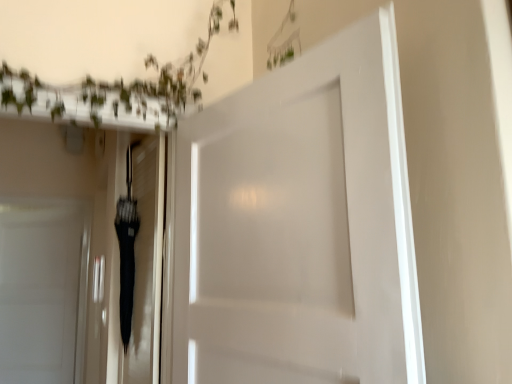
Question: Can you see black glossy umbrella at center touching white matte door at center, the second door from the back?

Choices:
 (A) yes
 (B) no

Answer: (B)

Question: Can you confirm if black glossy umbrella at center is positioned to the left of white matte door at center, acting as the 1th door starting from the front?

Choices:
 (A) yes
 (B) no

Answer: (A)

Question: Is black glossy umbrella at center not inside white matte door at center, placed as the first door when sorted from right to left?

Choices:
 (A) no
 (B) yes

Answer: (B)

Question: Is black glossy umbrella at center at the right side of white matte door at center, placed as the first door when sorted from right to left?

Choices:
 (A) yes
 (B) no

Answer: (B)

Question: From a real-world perspective, is black glossy umbrella at center located beneath white matte door at center, positioned as the second door in left-to-right order?

Choices:
 (A) yes
 (B) no

Answer: (A)

Question: From a real-world perspective, relative to white matte door at center, the second door from the back, is black glossy umbrella at center vertically above or below?

Choices:
 (A) below
 (B) above

Answer: (A)

Question: In the image, is black glossy umbrella at center positioned in front of or behind white matte door at center, the second door from the back?

Choices:
 (A) behind
 (B) front

Answer: (A)

Question: Which is correct: black glossy umbrella at center is inside white matte door at center, acting as the 1th door starting from the front, or outside of it?

Choices:
 (A) inside
 (B) outside

Answer: (B)

Question: Looking at the image, does black glossy umbrella at center seem bigger or smaller compared to white matte door at center, positioned as the second door in left-to-right order?

Choices:
 (A) big
 (B) small

Answer: (B)

Question: Is white matte door at left, the second door when ordered from front to back, wider or thinner than white matte door at center, acting as the 1th door starting from the front?

Choices:
 (A) wide
 (B) thin

Answer: (B)

Question: Considering the positions of white matte door at left, the first door positioned from the back, and white matte door at center, acting as the 1th door starting from the front, in the image, is white matte door at left, the first door positioned from the back, taller or shorter than white matte door at center, acting as the 1th door starting from the front,?

Choices:
 (A) short
 (B) tall

Answer: (B)

Question: Is point (54, 329) positioned closer to the camera than point (284, 349)?

Choices:
 (A) farther
 (B) closer

Answer: (A)

Question: Is white matte door at left, the first door positioned from the back, inside the boundaries of white matte door at center, the second door from the back, or outside?

Choices:
 (A) outside
 (B) inside

Answer: (A)

Question: Is white matte door at left, the first door positioned from the back, to the left or to the right of black glossy umbrella at center in the image?

Choices:
 (A) left
 (B) right

Answer: (A)

Question: Is white matte door at left, the first door positioned from the back, in front of or behind black glossy umbrella at center in the image?

Choices:
 (A) front
 (B) behind

Answer: (B)